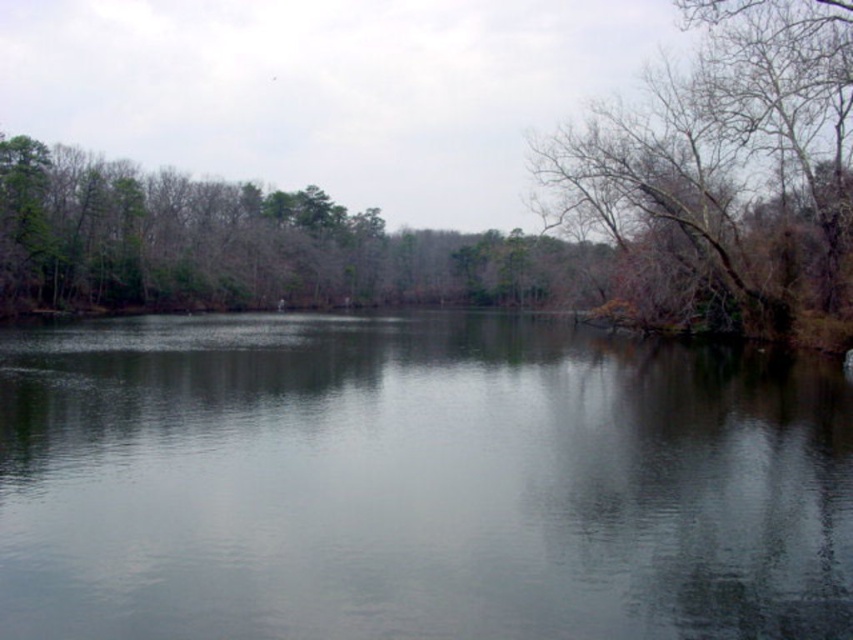
Question: Among these points, which one is farthest from the camera?

Choices:
 (A) (219, 580)
 (B) (706, 312)

Answer: (B)

Question: Which point is farther from the camera taking this photo?

Choices:
 (A) (834, 337)
 (B) (828, 426)

Answer: (A)

Question: Does smooth water at center have a lesser width compared to bare branches at right?

Choices:
 (A) no
 (B) yes

Answer: (A)

Question: Does smooth water at center have a smaller size compared to bare branches at right?

Choices:
 (A) no
 (B) yes

Answer: (B)

Question: Is smooth water at center wider than bare branches at right?

Choices:
 (A) yes
 (B) no

Answer: (A)